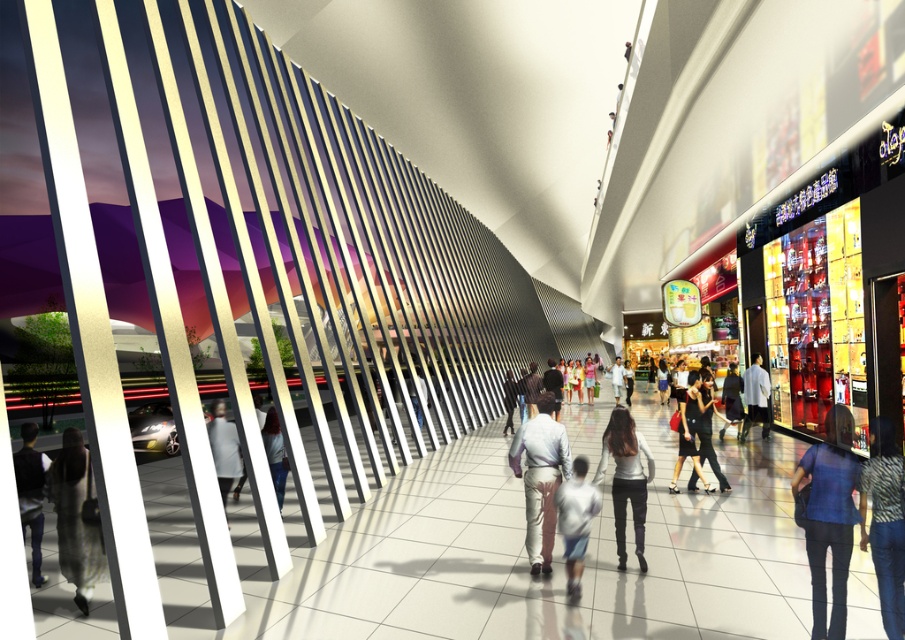
Looking at this image, you are a fashion designer observing the modern shopping mall interior. You notice the dark gray pants at lower left and the black leather jacket at center. Which of these two items has a greater height?

The dark gray pants at lower left has a greater height compared to the black leather jacket at center.

Looking at this image, you are standing in the shopping mall and see two points marked on the floor. The first point is at coordinate point (44, 472) and the second is at coordinate point (691, 374). Which point is closer to your current position if you are facing the direction where the vertical panels are located?

Point (44, 472) is closer to the camera than point (691, 374), so if you are facing the direction of the vertical panels, the point closer to your current position would be point (44, 472).

You are a customer in the mall and you want to take a photo of the zebra print shirt at center and denim pants at center. Which one should you focus on first if you want to capture both clearly in the same frame?

The zebra print shirt at center should be focused on first because it is in front of the denim pants at center, ensuring both will be in focus when starting with the closer object.